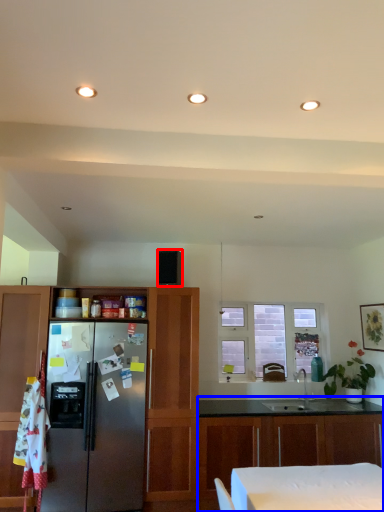
Question: Which of the following is the closest to the observer, appliance (highlighted by a red box) or cabinetry (highlighted by a blue box)?

Choices:
 (A) appliance
 (B) cabinetry

Answer: (B)